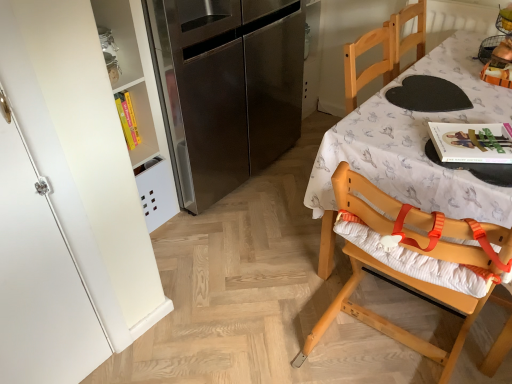
You are a GUI agent. You are given a task and a screenshot of the screen. Output one action in this format:
    pyautogui.click(x=<x>, y=<y>)
    Task: Click on the vacant area that lies in front of stainless steel refrigerator at left
    This screenshot has width=512, height=384.
    Given the screenshot: What is the action you would take?
    pyautogui.click(x=241, y=240)